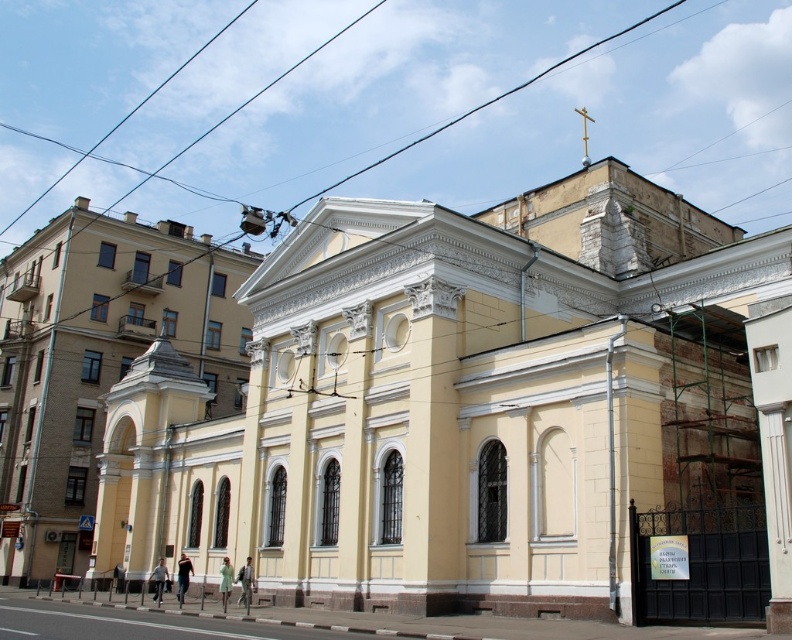
Question: Does yellow matte church at center come behind yellow smooth church at center?

Choices:
 (A) yes
 (B) no

Answer: (B)

Question: Can you confirm if yellow matte church at center is smaller than yellow smooth church at center?

Choices:
 (A) no
 (B) yes

Answer: (A)

Question: In this image, where is yellow matte church at center located relative to yellow smooth church at center?

Choices:
 (A) right
 (B) left

Answer: (A)

Question: Which point appears closest to the camera in this image?

Choices:
 (A) (55, 305)
 (B) (528, 397)

Answer: (B)

Question: Which object appears closest to the camera in this image?

Choices:
 (A) yellow smooth church at center
 (B) yellow matte church at center

Answer: (B)